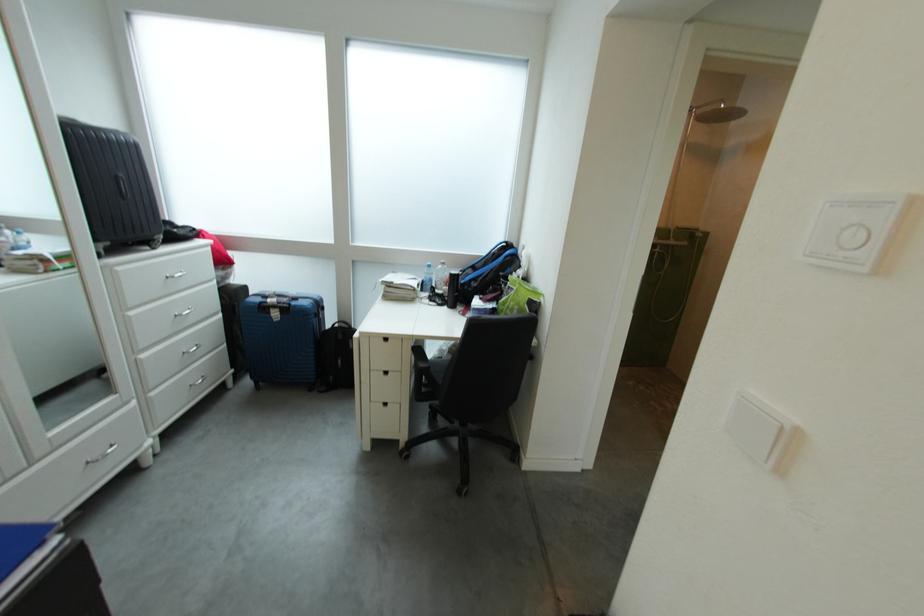
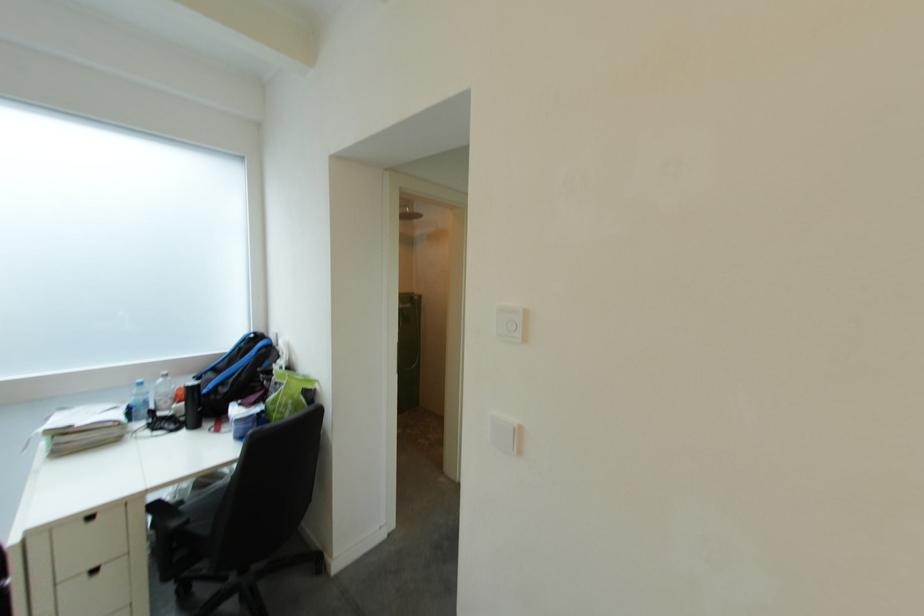
The point at (445, 288) is marked in the first image. Where is the corresponding point in the second image?

(163, 410)